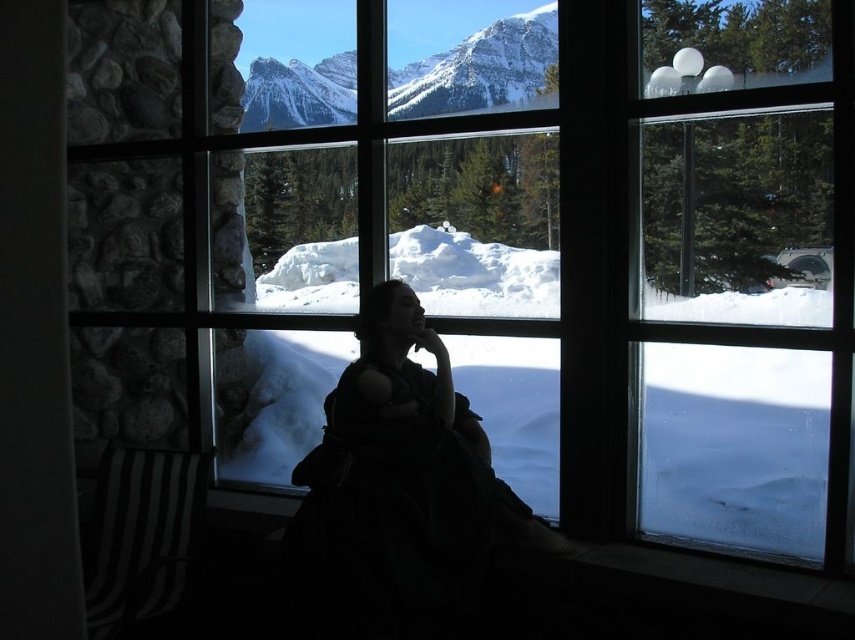
Consider the image. Is snowy granite mountains at upper left shorter than white fluffy snow at center?

No, snowy granite mountains at upper left is not shorter than white fluffy snow at center.

Who is positioned more to the right, snowy granite mountains at upper left or white fluffy snow at center?

white fluffy snow at center is more to the right.

I want to click on snowy granite mountains at upper left, so click(479, 67).

Image resolution: width=855 pixels, height=640 pixels. What are the coordinates of `snowy granite mountains at upper left` in the screenshot? It's located at (479, 67).

Looking at this image, can you confirm if transparent glass window at center is smaller than white fluffy snow at center?

No, transparent glass window at center is not smaller than white fluffy snow at center.

Is transparent glass window at center shorter than white fluffy snow at center?

Incorrect, transparent glass window at center's height does not fall short of white fluffy snow at center's.

Identify the location of transparent glass window at center. (624, 262).

Which of these two, transparent glass window at upper right or white fluffy snow at center, stands shorter?

white fluffy snow at center

Is transparent glass window at upper right taller than white fluffy snow at center?

Yes, transparent glass window at upper right is taller than white fluffy snow at center.

Measure the distance between transparent glass window at upper right and camera.

They are 7.55 feet apart.

Where is `transparent glass window at upper right`? This screenshot has height=640, width=855. transparent glass window at upper right is located at coordinates (753, 294).